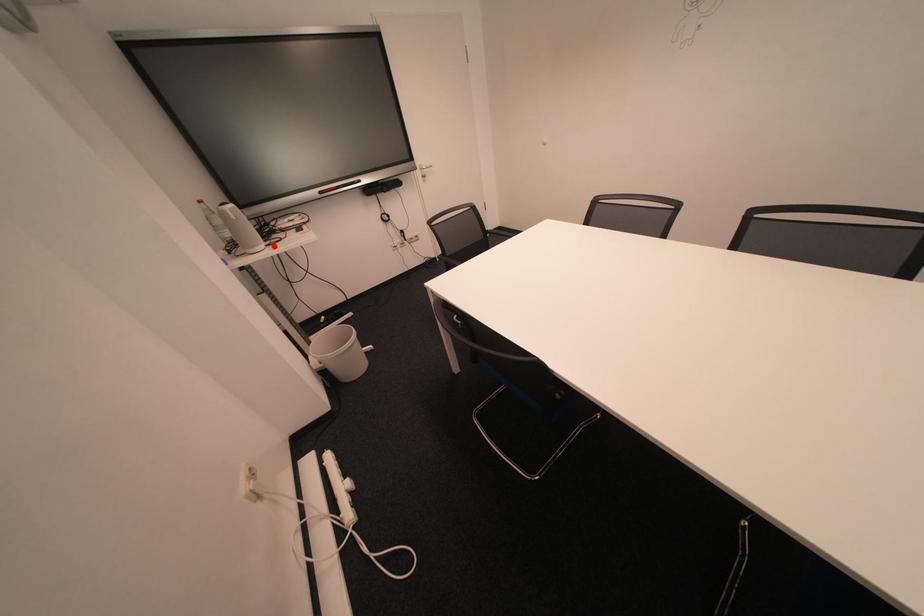
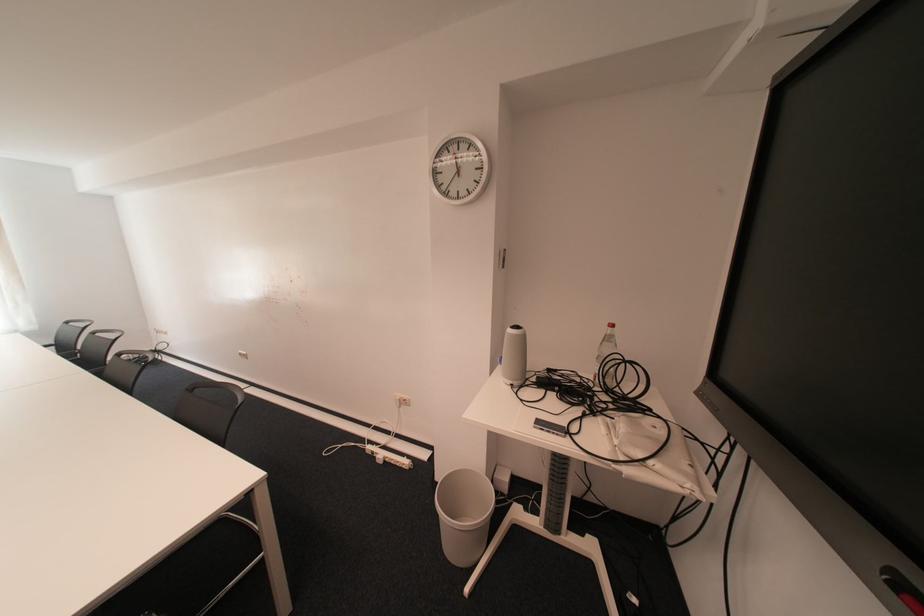
The point at the highlighted location is marked in the first image. Where is the corresponding point in the second image?

(520, 383)